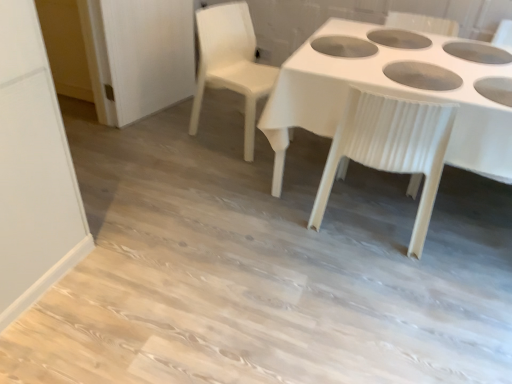
This screenshot has height=384, width=512. What are the coordinates of `free space between white plastic table at center and white plastic chair at center, arranged as the 1th chair when viewed from the right` in the screenshot? It's located at (346, 237).